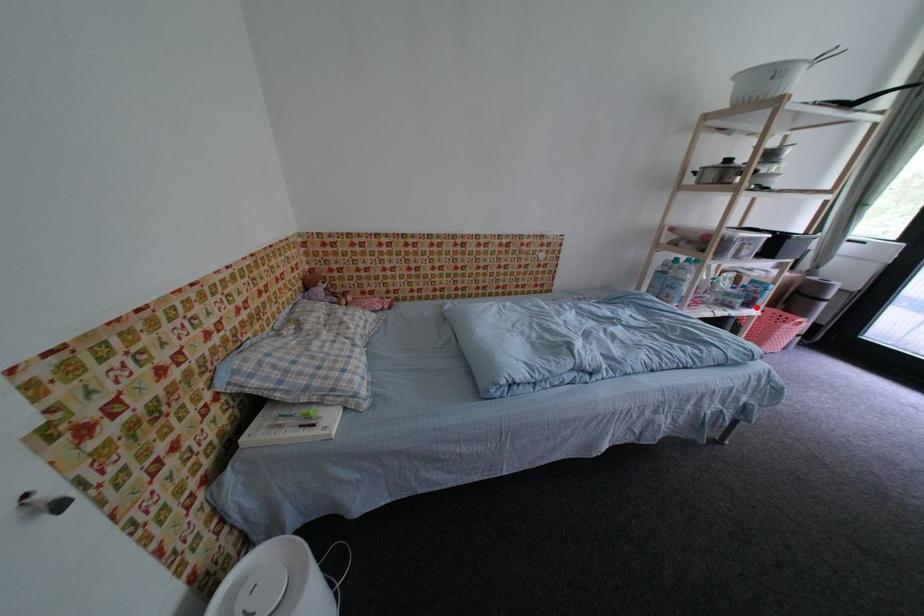
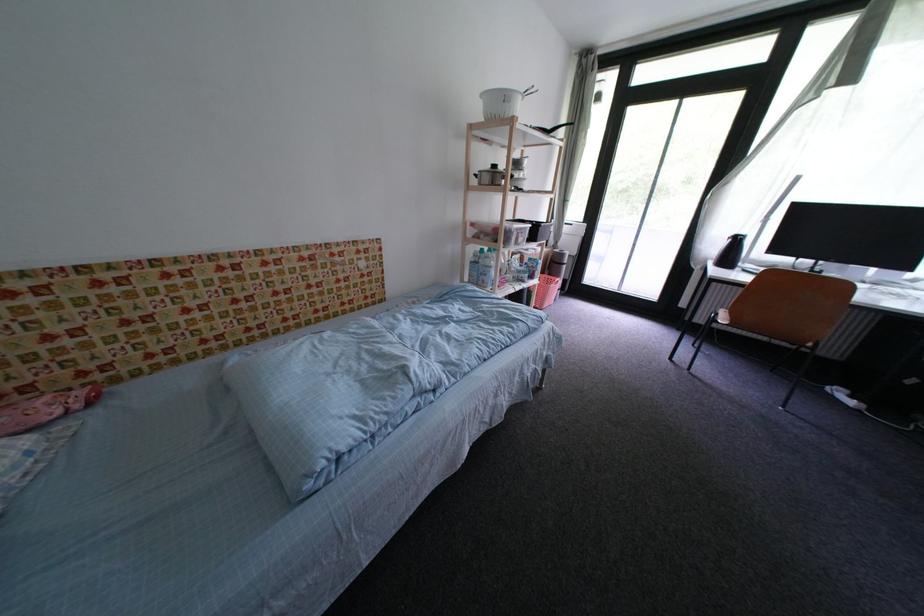
Locate, in the second image, the point that corresponds to the highlighted location in the first image.

(540, 280)